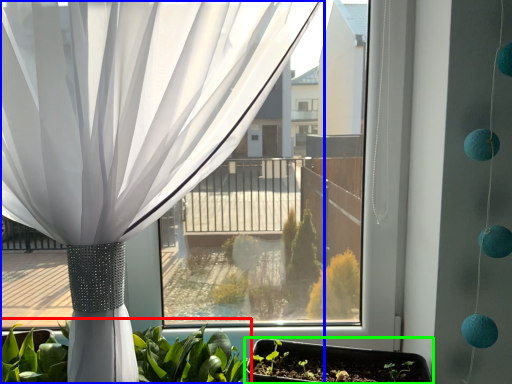
Question: Considering the real-world distances, which object is closest to houseplant (highlighted by a red box)? curtain (highlighted by a blue box) or flowerpot (highlighted by a green box).

Choices:
 (A) curtain
 (B) flowerpot

Answer: (B)